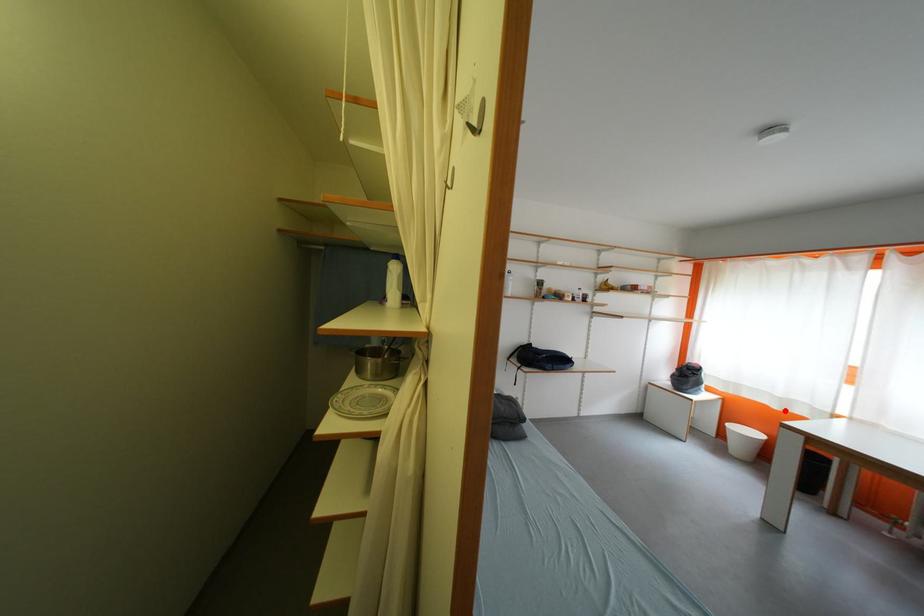
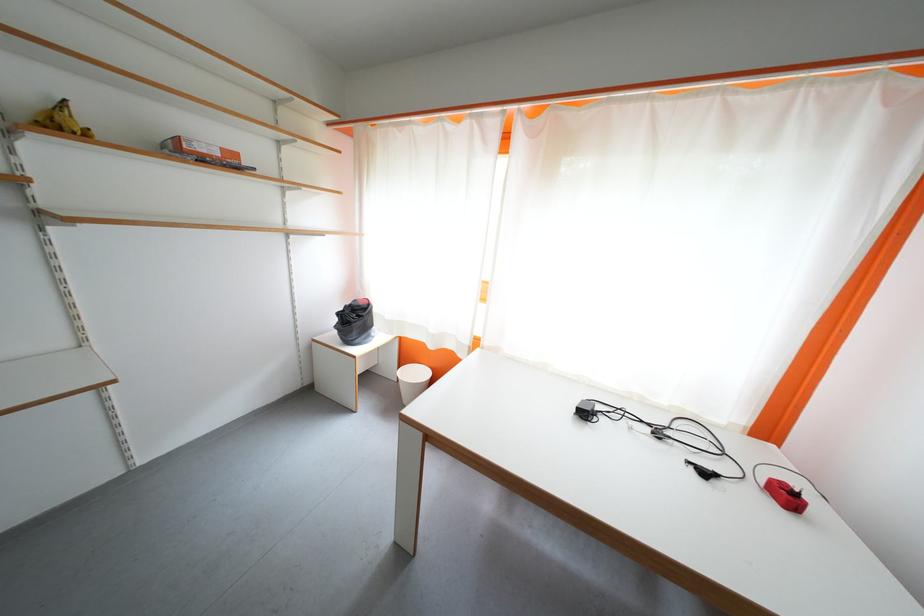
In the second image, find the point that corresponds to the highlighted location in the first image.

(440, 350)